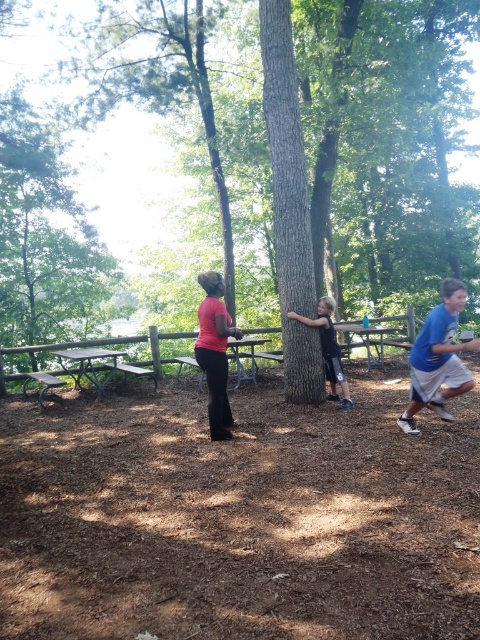
Please provide the exact 2D coordinates of the black matte shirt at center in the image. The answer should be in the format of a coordinate pair like this example format of 0.547, 0.683.

The exact 2D coordinates of the black matte shirt at center are at point (327, 349).

You are a photographer trying to capture a photo of the blue cotton shirt at right and the matte pink shirt at center. If you want to frame both shirts in the same shot, which direction should you move the camera to ensure both are visible?

Since the blue cotton shirt at right is positioned on the right side of matte pink shirt at center, you should move the camera to the left to include both shirts in the frame.

Consider the image. You are standing in the wooded area and want to reach a specific point marked as point (72,243). If your walking speed is 1.5 meters per second, how many seconds will it take you to reach the point?

The point (72,243) is 13.33 meters away from the viewer. At a walking speed of 1.5 meters per second, it will take approximately 8.89 seconds to reach the point.